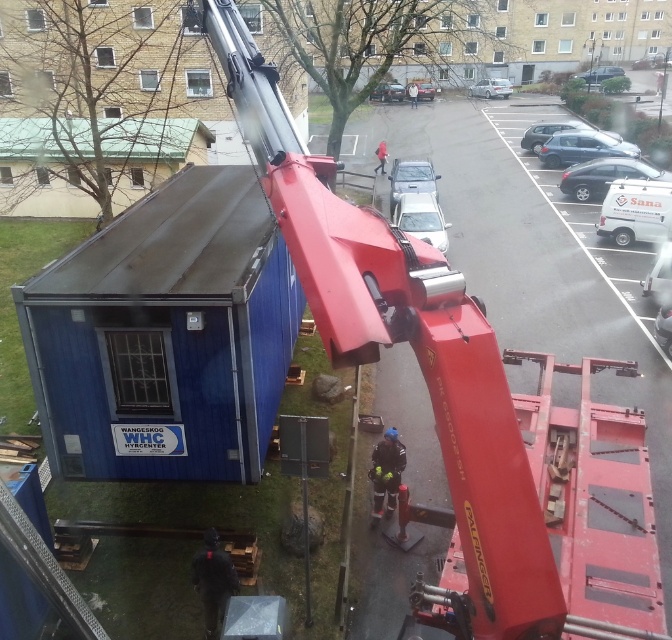
Does metallic silver car at upper right lie in front of red fabric jacket at center?

No, metallic silver car at upper right is behind red fabric jacket at center.

Consider the image. Which is above, metallic silver car at upper right or red fabric jacket at center?

metallic silver car at upper right

What are the coordinates of `metallic silver car at upper right` in the screenshot? It's located at (599, 74).

In order to click on metallic silver car at upper right in this screenshot , I will do `click(599, 74)`.

Can you confirm if silver metallic sedan at center is taller than metallic silver car at lower right?

Yes.

Does silver metallic sedan at center appear on the left side of metallic silver car at lower right?

In fact, silver metallic sedan at center is to the right of metallic silver car at lower right.

Is point (528, 138) in front of point (655, 330)?

No, (528, 138) is behind (655, 330).

Find the location of a particular element. silver metallic sedan at center is located at coordinates (545, 132).

Is metallic red crane arm at center below metallic blue sedan at upper right?

Yes, metallic red crane arm at center is below metallic blue sedan at upper right.

Between metallic red crane arm at center and metallic blue sedan at upper right, which one appears on the left side from the viewer's perspective?

metallic red crane arm at center

Between point (448, 320) and point (595, 150), which one is positioned behind?

Point (595, 150)

The width and height of the screenshot is (672, 640). What are the coordinates of `metallic red crane arm at center` in the screenshot? It's located at (420, 368).